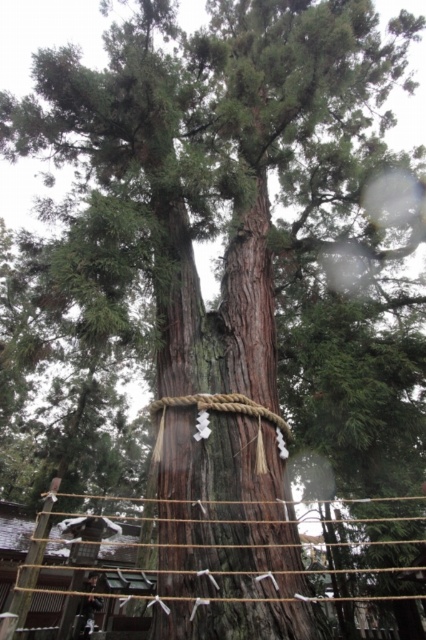
You are a photographer standing in front of the brown rough tree trunk at center. You want to take a photo of the tree while ensuring that you are exactly 3 meters away from it. Based on your current position, is your distance sufficient to meet this requirement?

The distance between you and the brown rough tree trunk at center is 3.30 meters, which is slightly more than the required 3 meters. Therefore, your current position is sufficient to meet the requirement.

You are a hiker who wants to cross the braided wood rope bridge at center. To do so, you must first pass by the brown rough tree trunk at center. Is the tree trunk blocking your path to the bridge?

The brown rough tree trunk at center is further to the viewer than the braided wood rope bridge at center, so the tree trunk is not blocking your path to the bridge. You can walk around or behind the tree trunk to reach the bridge.